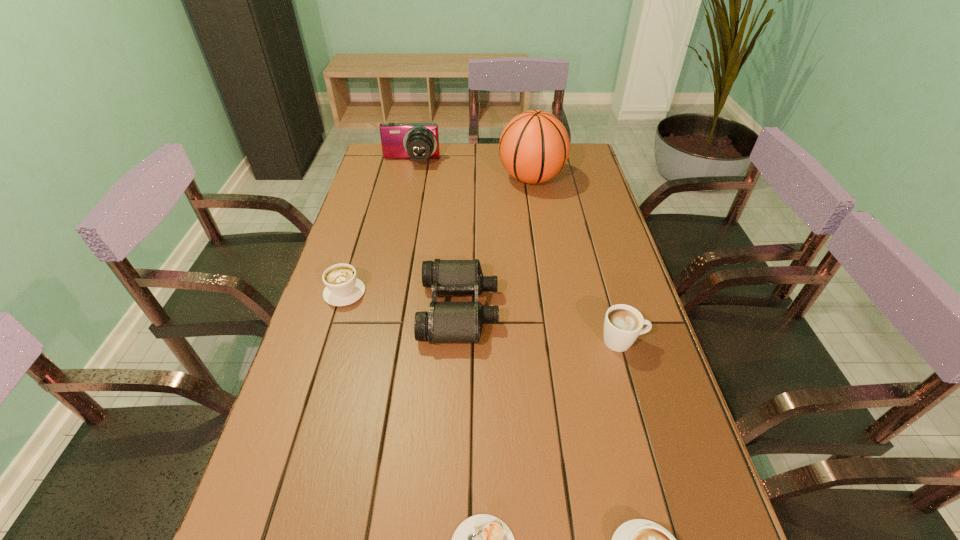
The image size is (960, 540). In order to click on free space at the far edge in this screenshot , I will do `click(458, 146)`.

Locate an element on the screen. This screenshot has height=540, width=960. blank area at the left edge is located at coordinates (374, 190).

This screenshot has width=960, height=540. Identify the location of vacant space at the right edge. (595, 332).

The width and height of the screenshot is (960, 540). I want to click on free location at the far left corner, so click(372, 161).

Find the location of a particular element. Image resolution: width=960 pixels, height=540 pixels. free spot between the binoculars and the tallest cappuccino is located at coordinates (541, 325).

Identify the location of empty location between the camera and the binoculars. The image size is (960, 540). (435, 236).

The height and width of the screenshot is (540, 960). I want to click on vacant space that's between the camera and the second farthest cappuccino, so click(x=516, y=252).

Find the location of a particular element. The width and height of the screenshot is (960, 540). object that is the fourth nearest to the third nearest cappuccino is located at coordinates (534, 146).

You are a GUI agent. You are given a task and a screenshot of the screen. Output one action in this format:
    pyautogui.click(x=<x>, y=<y>)
    Task: Click on the object that stands as the fourth closest to the second shortest object
    The height and width of the screenshot is (540, 960).
    Given the screenshot: What is the action you would take?
    point(342,288)

Identify which cappuccino is the nearest to the third nearest cappuccino. Please provide its 2D coordinates. Your answer should be formatted as a tuple, i.e. [(x, y)], where the tuple contains the x and y coordinates of a point satisfying the conditions above.

[(638, 539)]